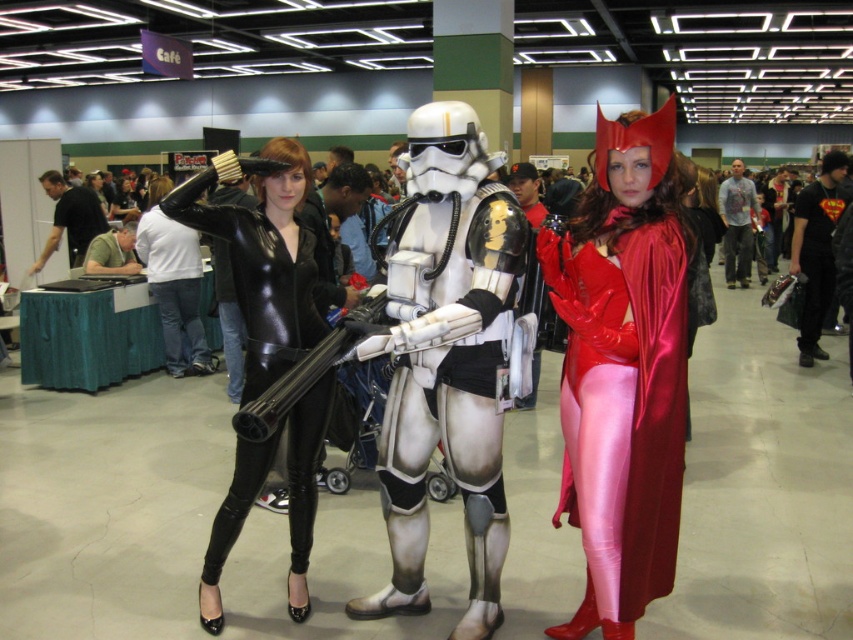
You are a photographer at the event and need to capture a photo of the white metallic armor at center and the black shiny suit at center. Which one should you focus on first if you want to ensure both are in focus without adjusting your camera settings?

The white metallic armor at center is positioned under the black shiny suit at center, so focusing on the black shiny suit at center first would allow the white metallic armor at center to remain in focus as it is closer to the camera.

You are a photographer at the event and want to capture the shiny red cape at center and the white metallic armor at center in a single shot. Which object should you focus on first if you want to ensure both are in sharp focus?

Since the shiny red cape at center is located above the white metallic armor at center, you should focus on the white metallic armor at center first as it is closer to the camera. This will ensure the depth of field captures both objects in focus.

You are a photographer at the event and need to capture a photo of both the shiny red cape at center and the white metallic armor at center. Since you want to ensure both are in focus, which object should you position closer to the camera to achieve this?

The shiny red cape at center is in front of the white metallic armor at center, so positioning the shiny red cape at center closer to the camera will help both be in focus as they are already layered with the cape in front.